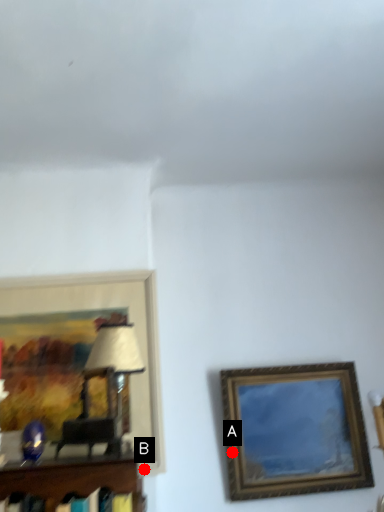
Question: Two points are circled on the image, labeled by A and B beside each circle. Which of the following is the closest to the observer?

Choices:
 (A) A is closer
 (B) B is closer

Answer: (B)